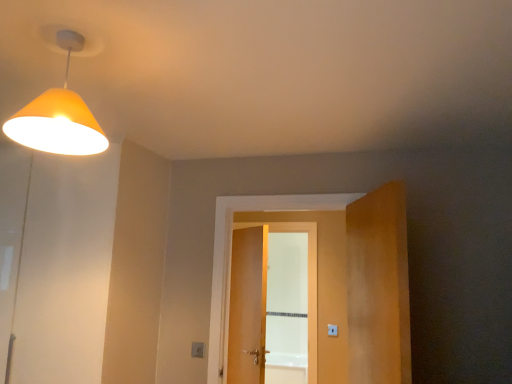
Question: Is the depth of orange matte lampshade at upper left less than that of white plastic light switch at lower center?

Choices:
 (A) no
 (B) yes

Answer: (B)

Question: From a real-world perspective, does orange matte lampshade at upper left stand above white plastic light switch at lower center?

Choices:
 (A) yes
 (B) no

Answer: (A)

Question: Could you tell me if orange matte lampshade at upper left is facing white plastic light switch at lower center?

Choices:
 (A) yes
 (B) no

Answer: (B)

Question: Can you confirm if orange matte lampshade at upper left is thinner than white plastic light switch at lower center?

Choices:
 (A) no
 (B) yes

Answer: (A)

Question: Can you confirm if orange matte lampshade at upper left is taller than white plastic light switch at lower center?

Choices:
 (A) no
 (B) yes

Answer: (B)

Question: Does orange matte lampshade at upper left have a larger size compared to white plastic light switch at lower center?

Choices:
 (A) no
 (B) yes

Answer: (B)

Question: Is orange matte lampshade at upper left positioned far away from wooden door at center?

Choices:
 (A) yes
 (B) no

Answer: (A)

Question: Is orange matte lampshade at upper left smaller than wooden door at center?

Choices:
 (A) no
 (B) yes

Answer: (B)

Question: Is orange matte lampshade at upper left positioned before wooden door at center?

Choices:
 (A) yes
 (B) no

Answer: (A)

Question: Is orange matte lampshade at upper left looking in the opposite direction of wooden door at center?

Choices:
 (A) yes
 (B) no

Answer: (B)

Question: From the image's perspective, is orange matte lampshade at upper left beneath wooden door at center?

Choices:
 (A) yes
 (B) no

Answer: (B)

Question: Can you confirm if orange matte lampshade at upper left is wider than wooden door at center?

Choices:
 (A) yes
 (B) no

Answer: (A)

Question: Considering the relative sizes of wooden door at center and orange matte lampshade at upper left in the image provided, is wooden door at center smaller than orange matte lampshade at upper left?

Choices:
 (A) yes
 (B) no

Answer: (B)